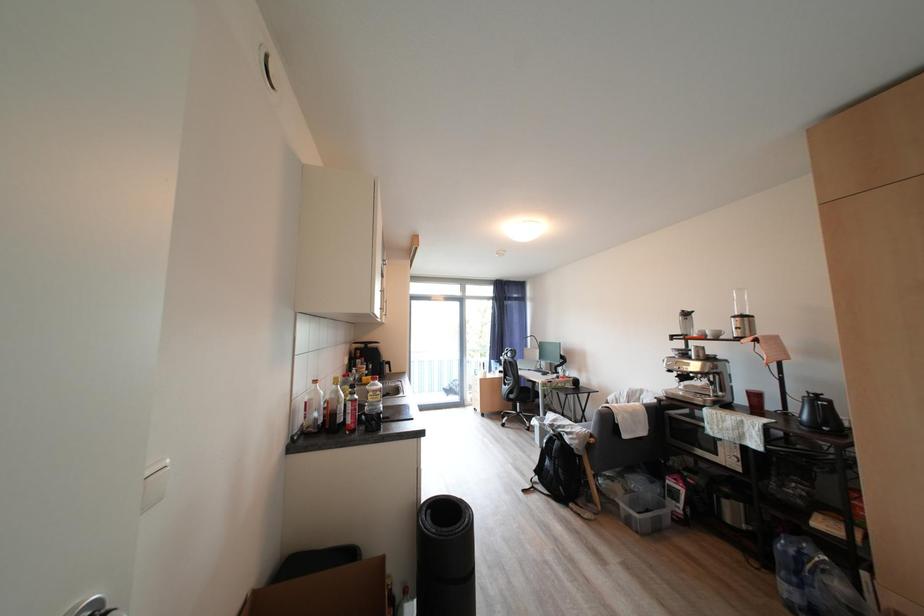
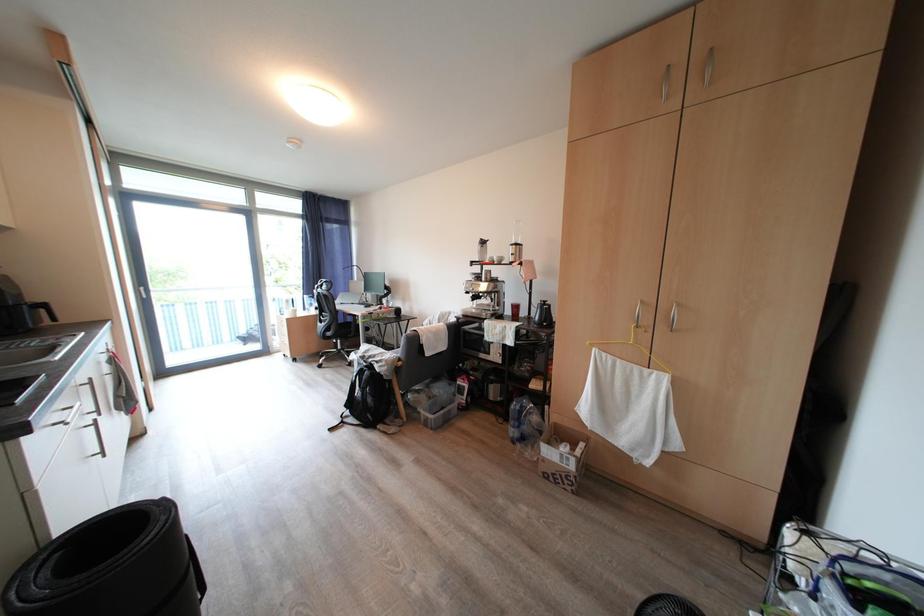
Question: The camera is either moving clockwise (left) or counter-clockwise (right) around the object. The first image is from the beginning of the video and the second image is from the end. Is the camera moving left or right when shooting the video?

Choices:
 (A) Left
 (B) Right

Answer: (A)